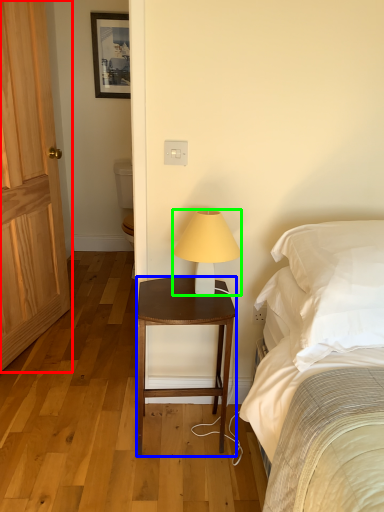
Question: Which is nearer to the door (highlighted by a red box)? nightstand (highlighted by a blue box) or lamp (highlighted by a green box).

Choices:
 (A) nightstand
 (B) lamp

Answer: (A)